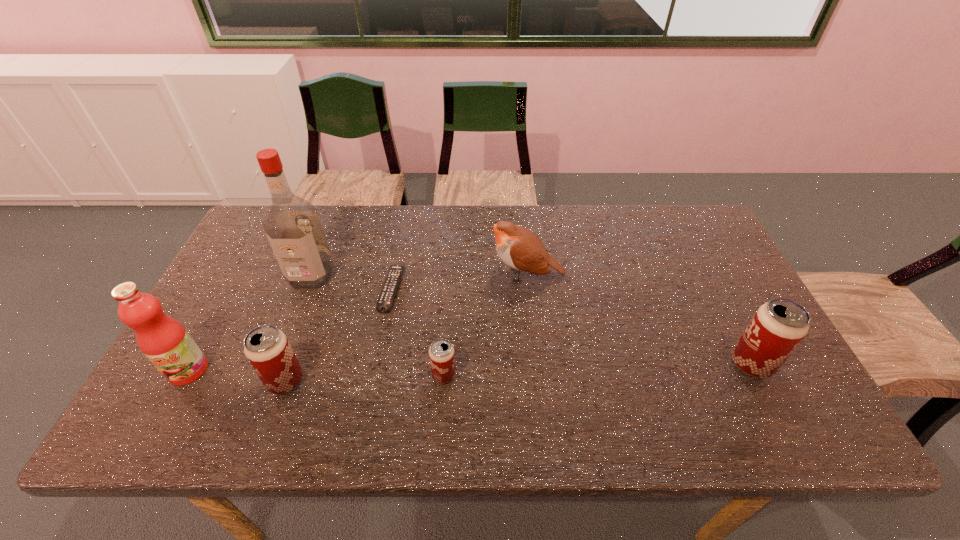
Locate an element on the screen. This screenshot has height=540, width=960. object that is positioned at the left edge is located at coordinates (164, 341).

Image resolution: width=960 pixels, height=540 pixels. I want to click on object that is positioned at the right edge, so click(778, 326).

In order to click on object present at the near left corner in this screenshot , I will do `click(164, 341)`.

Locate an element on the screen. This screenshot has width=960, height=540. object situated at the near right corner is located at coordinates (778, 326).

The image size is (960, 540). In the image, there is a desktop. Find the location of `blank space at the far edge`. blank space at the far edge is located at coordinates (361, 224).

You are a GUI agent. You are given a task and a screenshot of the screen. Output one action in this format:
    pyautogui.click(x=<x>, y=<y>)
    Task: Click on the free location at the near edge
    The height and width of the screenshot is (540, 960).
    Given the screenshot: What is the action you would take?
    pyautogui.click(x=627, y=397)

This screenshot has height=540, width=960. What are the coordinates of `vacant space at the left edge of the desktop` in the screenshot? It's located at (271, 273).

Locate an element on the screen. blank region between the rightmost object and the fifth tallest object is located at coordinates click(x=518, y=373).

Where is `free spot between the leftmost beer can and the liquor`? free spot between the leftmost beer can and the liquor is located at coordinates (299, 328).

The width and height of the screenshot is (960, 540). Find the location of `vacant area that lies between the bird and the shortest object`. vacant area that lies between the bird and the shortest object is located at coordinates (459, 282).